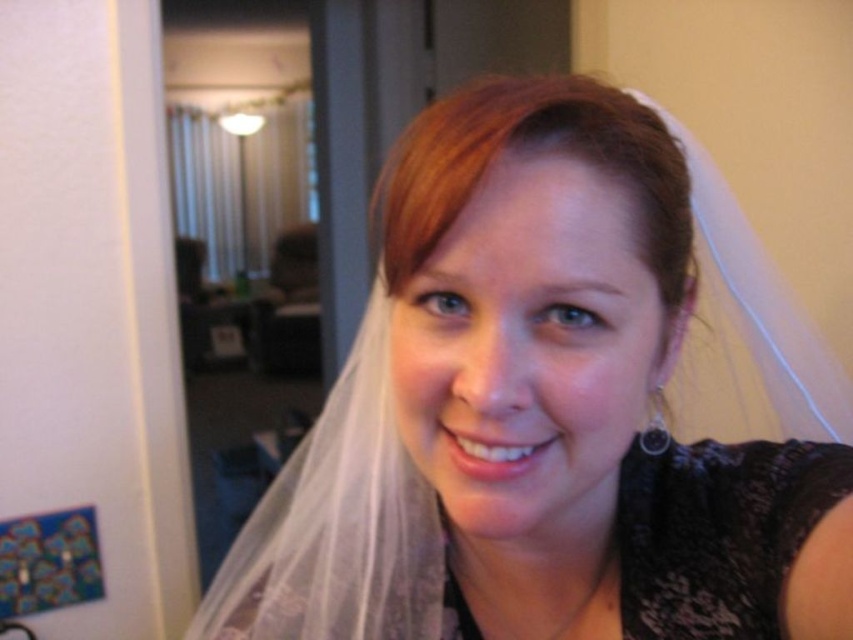
You are a photographer adjusting the camera frame to capture the subject wearing bridal attire. The translucent white veil at center and blonde silky hair at center are both in focus. Which object should you adjust the frame to include more of, considering one is wider than the other?

The translucent white veil at center is wider than the blonde silky hair at center, so you should adjust the frame to include more of the translucent white veil at center to ensure it is fully captured.

Where is the translucent white veil at center located in the image?

The translucent white veil at center is located at point (546, 408) in the image.

Looking at the bridal attire in the image, which object is positioned to the right of the other between the translucent white veil at center and the blonde silky hair at center?

The translucent white veil at center is positioned to the right of the blonde silky hair at center.